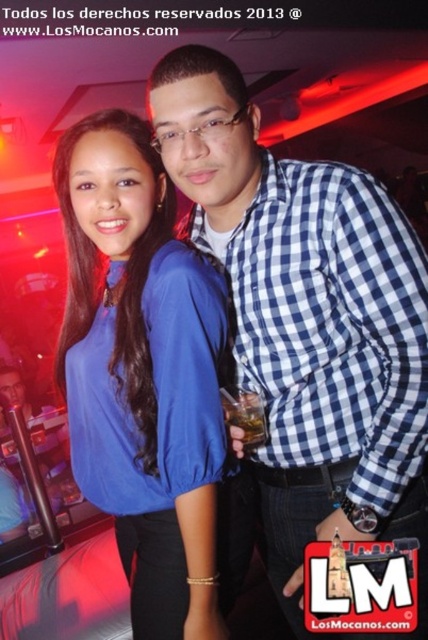
Does blue checkered shirt at center appear on the right side of matte blue blouse at center?

Correct, you'll find blue checkered shirt at center to the right of matte blue blouse at center.

How far apart are blue checkered shirt at center and matte blue blouse at center?

blue checkered shirt at center is 21.91 centimeters away from matte blue blouse at center.

The image size is (428, 640). Describe the element at coordinates (309, 323) in the screenshot. I see `blue checkered shirt at center` at that location.

Identify the location of blue checkered shirt at center. (309, 323).